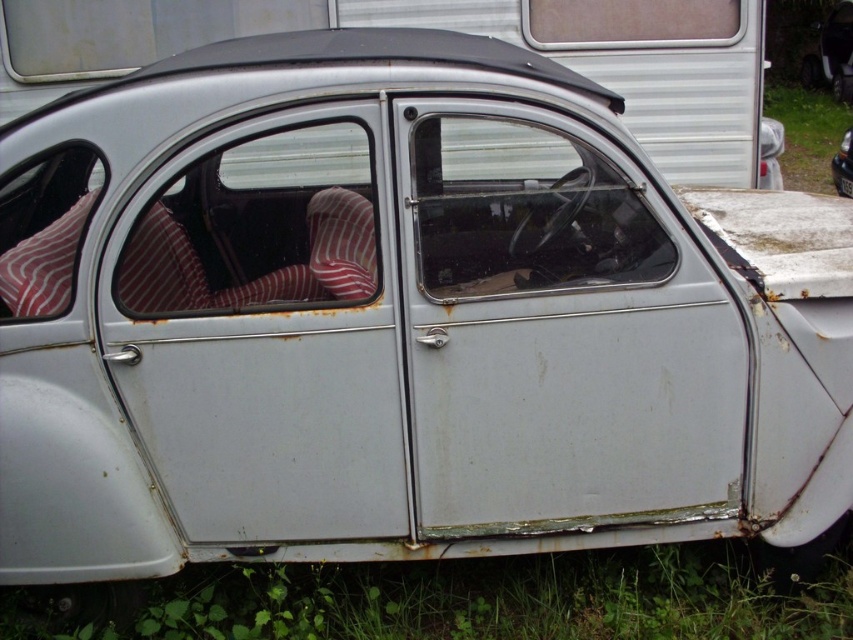
Can you confirm if green grass at lower center is positioned to the left of rusty metal car at center?

Correct, you'll find green grass at lower center to the left of rusty metal car at center.

Does green grass at lower center appear over rusty metal car at center?

No, green grass at lower center is not above rusty metal car at center.

Does point (415, 630) come closer to viewer compared to point (846, 157)?

Yes, point (415, 630) is closer to viewer.

This screenshot has height=640, width=853. What are the coordinates of `green grass at lower center` in the screenshot? It's located at (457, 600).